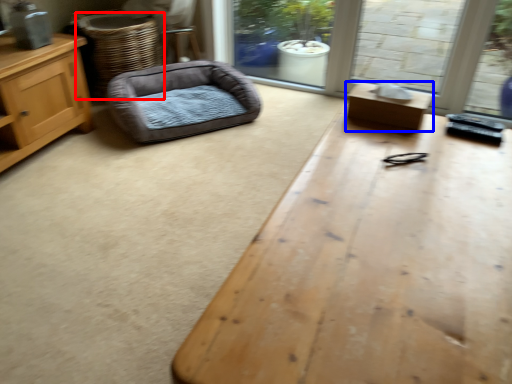
Question: Which object appears farthest to the camera in this image, basket (highlighted by a red box) or table (highlighted by a blue box)?

Choices:
 (A) basket
 (B) table

Answer: (A)